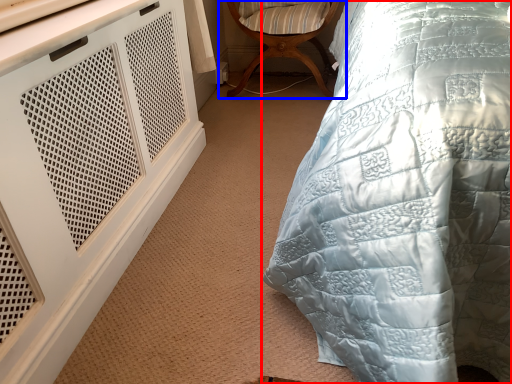
Question: Among these objects, which one is farthest to the camera, bed (highlighted by a red box) or chair (highlighted by a blue box)?

Choices:
 (A) bed
 (B) chair

Answer: (B)